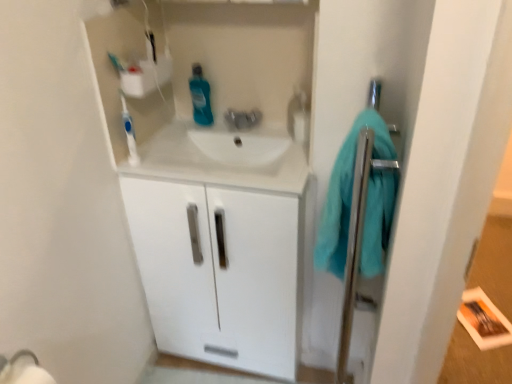
Question: Which is correct: white glossy cabinet at center is inside white glossy sink at center, or outside of it?

Choices:
 (A) inside
 (B) outside

Answer: (B)

Question: Considering the positions of white glossy cabinet at center and white glossy sink at center in the image, is white glossy cabinet at center taller or shorter than white glossy sink at center?

Choices:
 (A) short
 (B) tall

Answer: (B)

Question: Which object is the farthest from the white plastic toothbrush at upper left?

Choices:
 (A) teal soft towel at right
 (B) white glossy cabinet at center
 (C) white glossy sink at center
 (D) blue glossy mouthwash at center

Answer: (A)

Question: Which of these objects is positioned farthest from the white glossy cabinet at center?

Choices:
 (A) white plastic toothbrush at upper left
 (B) white glossy sink at center
 (C) blue glossy mouthwash at center
 (D) teal soft towel at right

Answer: (C)